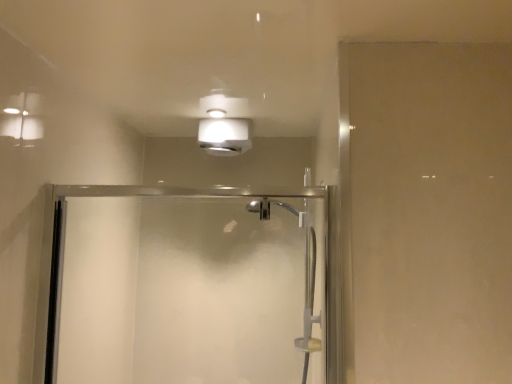
Question: Looking at their shapes, would you say clear glass shower door at center is wider or thinner than white matte light fixture at upper center?

Choices:
 (A) wide
 (B) thin

Answer: (B)

Question: Is clear glass shower door at center spatially inside white matte light fixture at upper center, or outside of it?

Choices:
 (A) inside
 (B) outside

Answer: (B)

Question: Considering the positions of clear glass shower door at center and white matte light fixture at upper center in the image, is clear glass shower door at center bigger or smaller than white matte light fixture at upper center?

Choices:
 (A) small
 (B) big

Answer: (B)

Question: Considering the relative positions of white matte light fixture at upper center and clear glass shower door at center in the image provided, is white matte light fixture at upper center to the left or to the right of clear glass shower door at center?

Choices:
 (A) right
 (B) left

Answer: (A)

Question: Is point (212, 92) positioned closer to the camera than point (320, 218)?

Choices:
 (A) closer
 (B) farther

Answer: (B)

Question: From their relative heights in the image, would you say white matte light fixture at upper center is taller or shorter than clear glass shower door at center?

Choices:
 (A) short
 (B) tall

Answer: (A)

Question: Considering the positions of white matte light fixture at upper center and clear glass shower door at center in the image, is white matte light fixture at upper center bigger or smaller than clear glass shower door at center?

Choices:
 (A) big
 (B) small

Answer: (B)